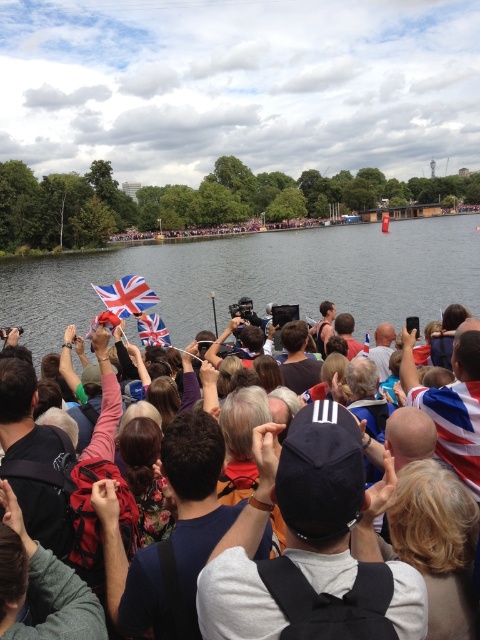
You are a photographer at the event and want to capture both the striped fabric flag at center and the union jack fabric flag at center in a single shot. Which flag should you adjust your camera angle to focus on first to ensure both are visible?

The striped fabric flag at center is in front of the union jack fabric flag at center, so you should focus on the striped fabric flag at center first to ensure it doesn not block the view of the union jack fabric flag at center behind it.

You are standing in the crowd watching the event by the river. If you want to take a photo of the clear water at center, where should you aim your camera relative to your current position?

The clear water at center is located at point 0.434 on the horizontal axis and 0.540 on the vertical axis, so you should aim your camera slightly to the right and above your current position to capture it.

You are standing at point A, which is located at point (26,305). You want to take a photo of the event happening across the river. The camera you have can focus on objects up to 200 feet away. Will you be able to capture the event clearly with your current camera?

The distance between point A at point (26,305) and the camera is 242.37 feet. Since the camera can only focus up to 200 feet, you will not be able to capture the event clearly with your current camera.